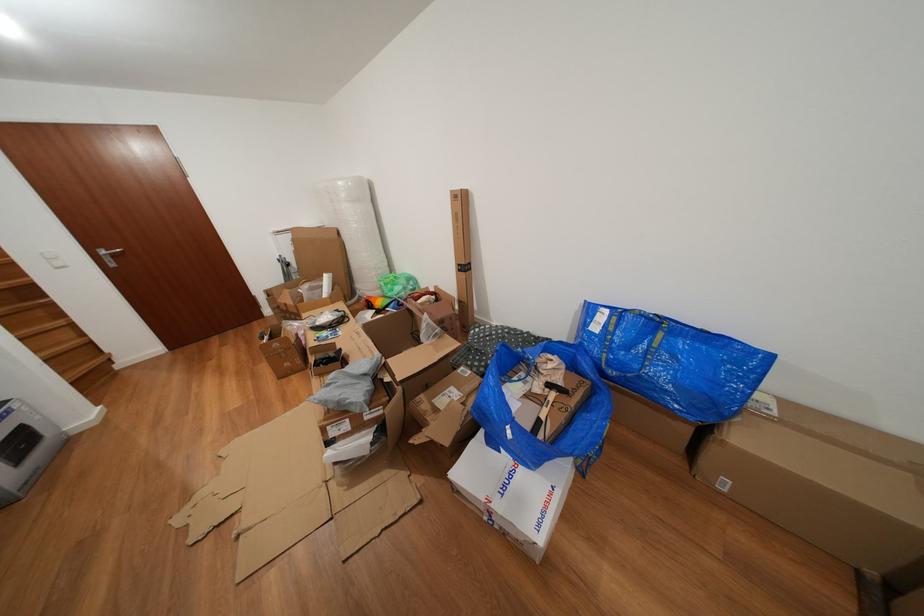
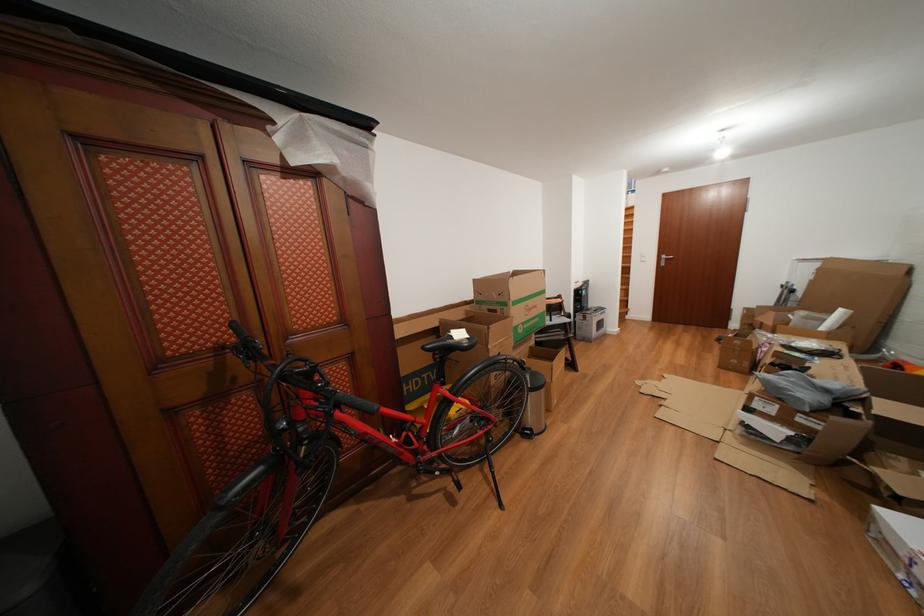
Locate, in the second image, the point that corresponds to pixel 98 246 in the first image.

(670, 256)